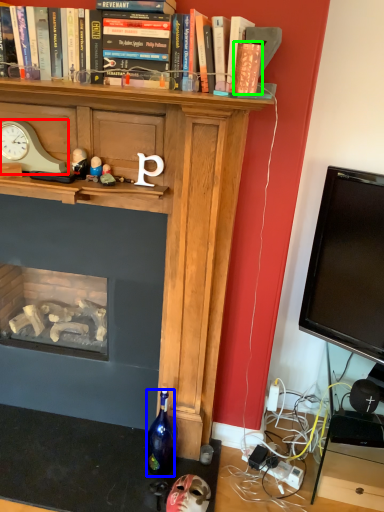
Question: Based on their relative distances, which object is nearer to clock (highlighted by a red box)? Choose from bottle (highlighted by a blue box) and paperback book (highlighted by a green box).

Choices:
 (A) bottle
 (B) paperback book

Answer: (B)